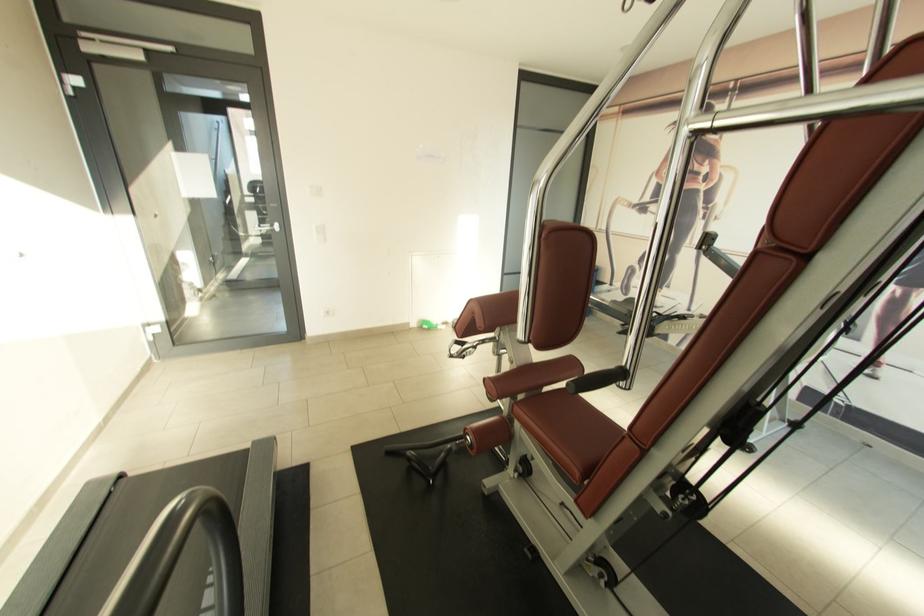
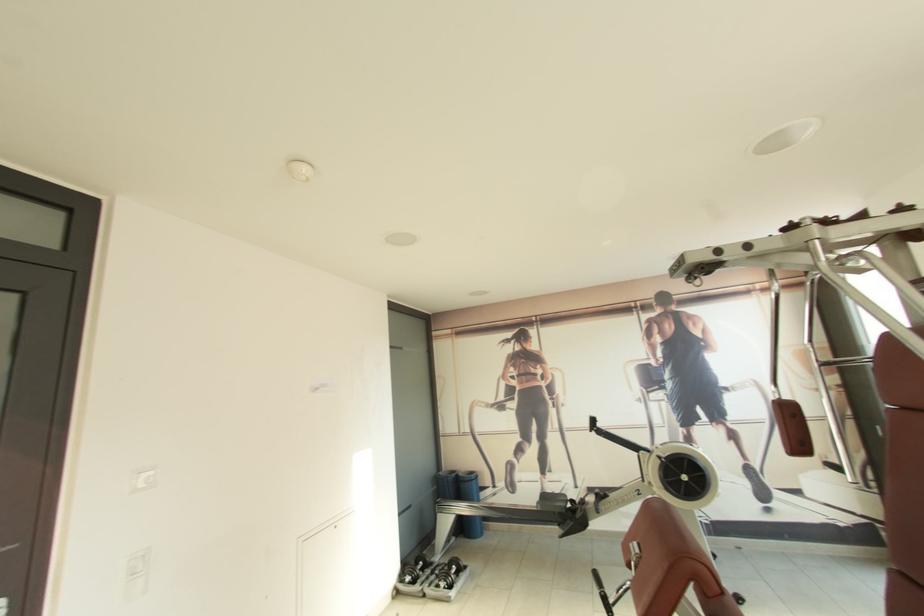
Locate, in the second image, the point that corresponds to the point at 610,236 in the first image.

(476, 438)